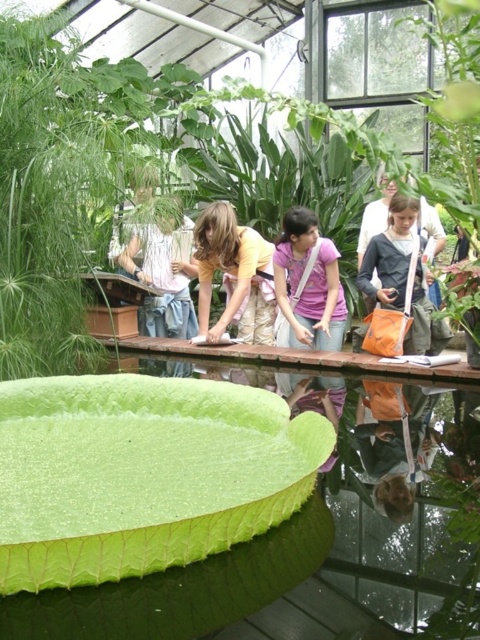
Between point (310, 321) and point (400, 280), which one is positioned in front?

Point (400, 280) is more forward.

Can you confirm if pink fabric shirt at center is taller than orange fabric bag at center-right?

No.

Is point (311, 300) positioned in front of point (402, 292)?

No, it is not.

Where is `pink fabric shirt at center`? pink fabric shirt at center is located at coordinates (309, 284).

Can you confirm if yellow matte shirt at center is positioned to the right of white cotton shirt at center?

Indeed, yellow matte shirt at center is positioned on the right side of white cotton shirt at center.

Based on the photo, measure the distance between yellow matte shirt at center and camera.

A distance of 4.88 meters exists between yellow matte shirt at center and camera.

Is point (257, 257) positioned after point (146, 321)?

No, it is not.

Locate an element on the screen. Image resolution: width=480 pixels, height=640 pixels. yellow matte shirt at center is located at coordinates (235, 275).

Which of these two, green leafy pond at lower left or white cotton shirt at center, stands taller?

With more height is white cotton shirt at center.

Based on the photo, is green leafy pond at lower left in front of white cotton shirt at center?

Yes, it is.

Identify the location of green leafy pond at lower left. (186, 492).